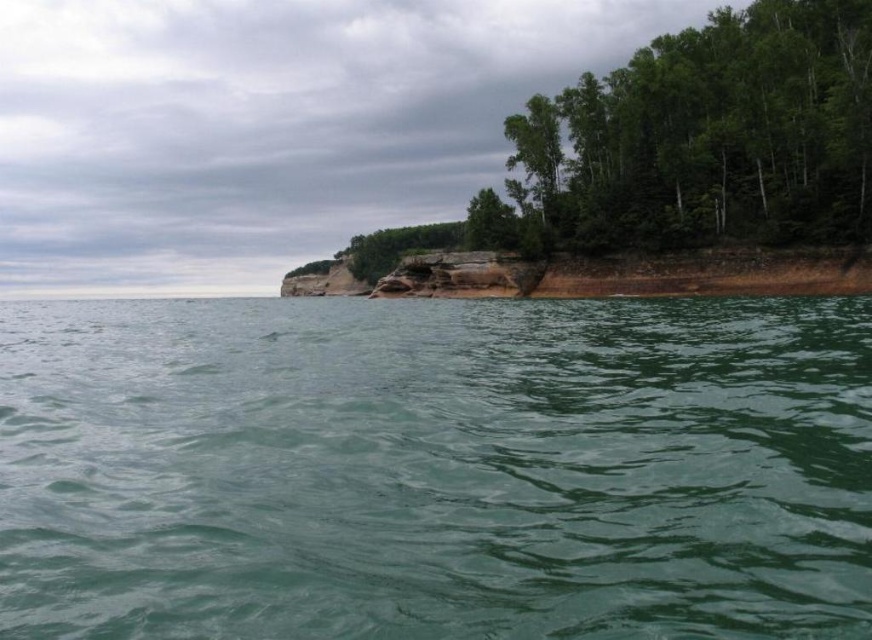
You are standing at the shoreline looking towards the cliff. Which object is closer to you, the green smooth water at center or the green leafy trees at upper right?

The green smooth water at center is closer to you because it is to the left of the green leafy trees at upper right, which are positioned further away.

Based on the scene description, what is located at the coordinates point (436, 468)?

The coordinates point (436, 468) is occupied by green smooth water at center.